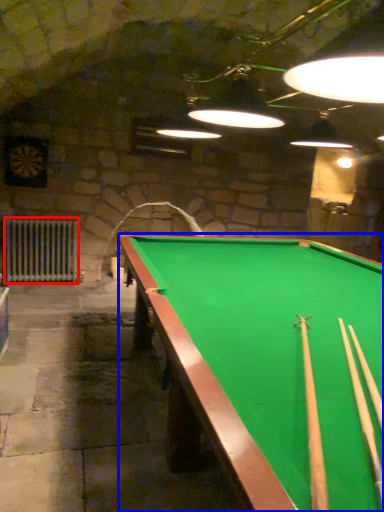
Question: Among these objects, which one is nearest to the camera, radiator (highlighted by a red box) or billiard table (highlighted by a blue box)?

Choices:
 (A) radiator
 (B) billiard table

Answer: (B)